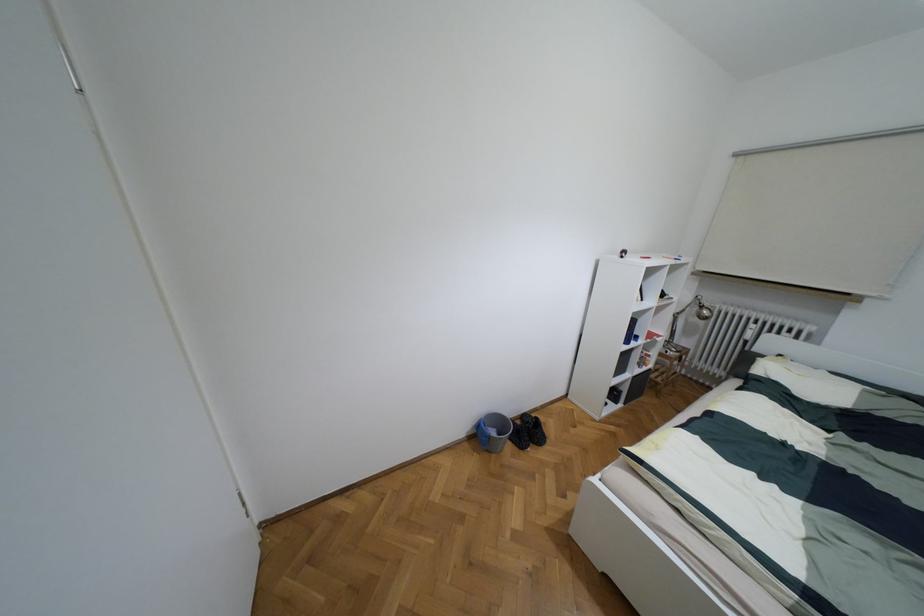
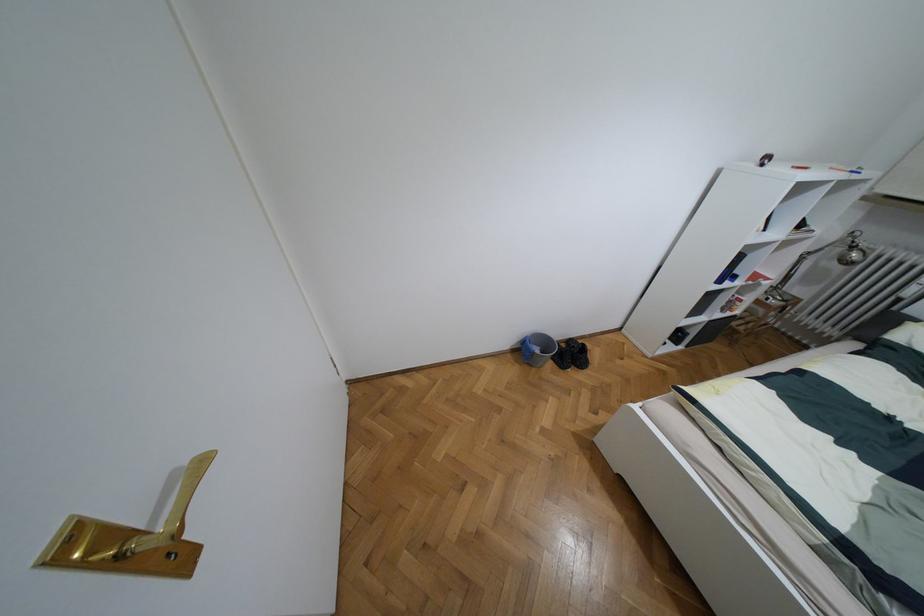
Find the pixel in the second image that matches (699,306) in the first image.

(852, 246)